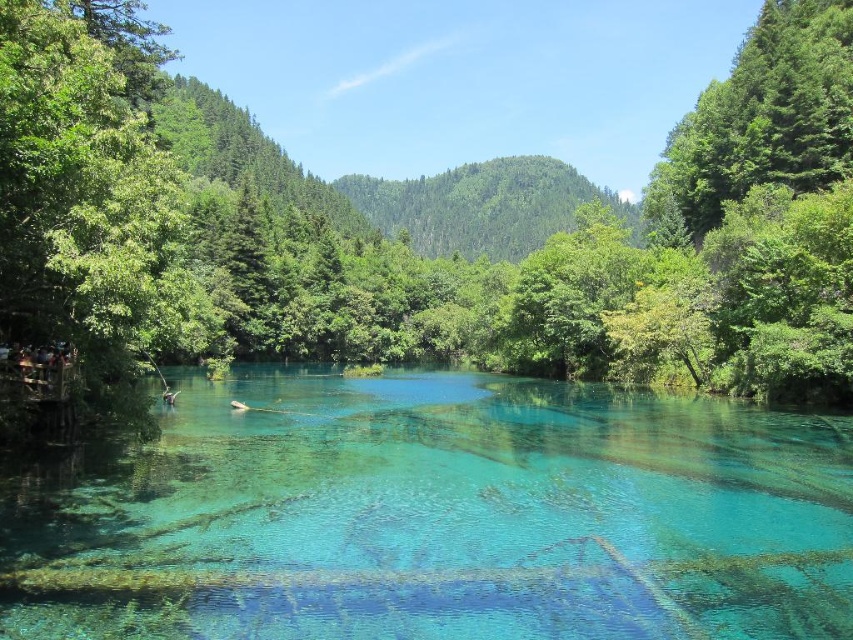
Is point (457, 438) behind point (842, 56)?

No.

Which is behind, point (619, 512) or point (653, 177)?

The point (653, 177) is more distant.

What do you see at coordinates (437, 516) in the screenshot?
I see `translucent blue water at center` at bounding box center [437, 516].

Locate an element on the screen. The image size is (853, 640). translucent blue water at center is located at coordinates (437, 516).

At what (x,y) coordinates should I click in order to perform the action: click on green leafy tree at center. Please return your answer as a coordinate pair (x, y). This screenshot has height=640, width=853. Looking at the image, I should click on (431, 225).

Is the position of green leafy tree at center less distant than that of green leafy tree at left?

No, it is behind green leafy tree at left.

Between point (122, 13) and point (106, 268), which one is positioned behind?

Point (122, 13)

Where is `green leafy tree at center`? This screenshot has width=853, height=640. green leafy tree at center is located at coordinates (431, 225).

Is green leafy tree at center positioned at the back of green leafy tree at upper right?

No, it is not.

Does green leafy tree at center appear on the right side of green leafy tree at upper right?

Incorrect, green leafy tree at center is not on the right side of green leafy tree at upper right.

Does point (515, 248) come farther from viewer compared to point (801, 29)?

Yes, it is.

This screenshot has height=640, width=853. Find the location of `green leafy tree at center`. green leafy tree at center is located at coordinates (431, 225).